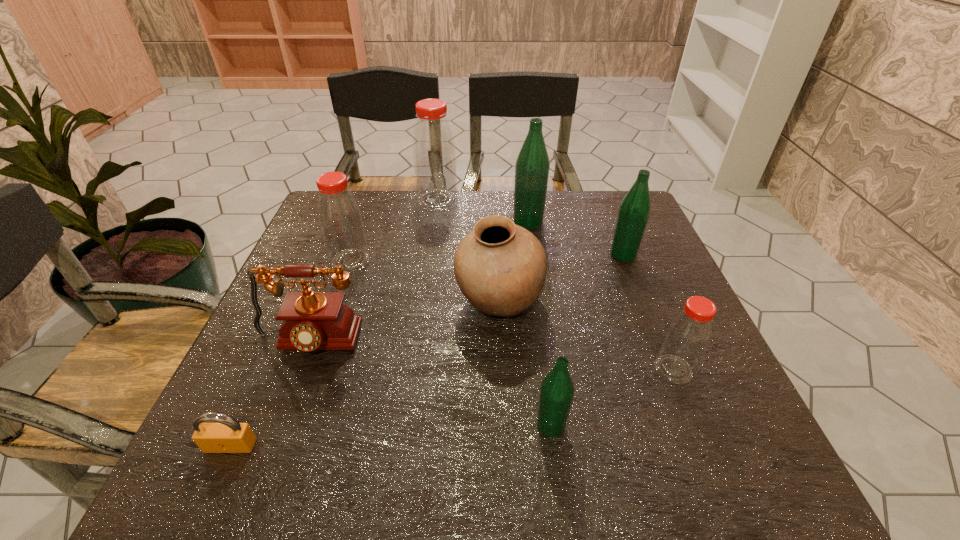
Where is `unoccupied position between the leftmost red bottle and the shortest object`? The image size is (960, 540). unoccupied position between the leftmost red bottle and the shortest object is located at coordinates (291, 353).

Where is `free space that is in between the farthest green bottle and the nearest red bottle`? The width and height of the screenshot is (960, 540). free space that is in between the farthest green bottle and the nearest red bottle is located at coordinates (601, 295).

This screenshot has width=960, height=540. I want to click on object that is the fourth closest one to the smallest red bottle, so click(532, 166).

Locate an element on the screen. This screenshot has height=540, width=960. object that is the fifth closest one to the nearest green bottle is located at coordinates (227, 435).

Select which bottle appears as the closest to the farthest green bottle. Please provide its 2D coordinates. Your answer should be formatted as a tuple, i.e. [(x, y)], where the tuple contains the x and y coordinates of a point satisfying the conditions above.

[(434, 155)]

At what (x,y) coordinates should I click in order to perform the action: click on the fourth closest bottle to the telephone. Please return your answer as a coordinate pair (x, y). Looking at the image, I should click on (532, 166).

Choose which red bottle is the nearest neighbor to the smallest green bottle. Please provide its 2D coordinates. Your answer should be formatted as a tuple, i.e. [(x, y)], where the tuple contains the x and y coordinates of a point satisfying the conditions above.

[(689, 333)]

Where is `red bottle that is the second nearest to the second smallest green bottle`? Image resolution: width=960 pixels, height=540 pixels. red bottle that is the second nearest to the second smallest green bottle is located at coordinates (434, 155).

Identify the location of green bottle that is the third nearest to the second farthest red bottle. The image size is (960, 540). click(635, 208).

Locate which green bottle ranks in proximity to the eighth nearest object. Please provide its 2D coordinates. Your answer should be formatted as a tuple, i.e. [(x, y)], where the tuple contains the x and y coordinates of a point satisfying the conditions above.

[(635, 208)]